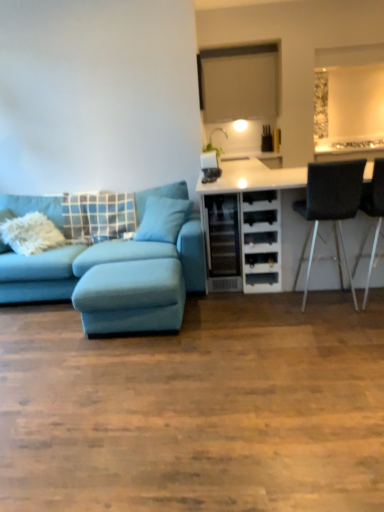
Image resolution: width=384 pixels, height=512 pixels. What are the coordinates of `vacant area that lies between black leather chair at right, which is the 1th chair in left-to-right order, and light blue fabric footrest at lower left` in the screenshot? It's located at (254, 312).